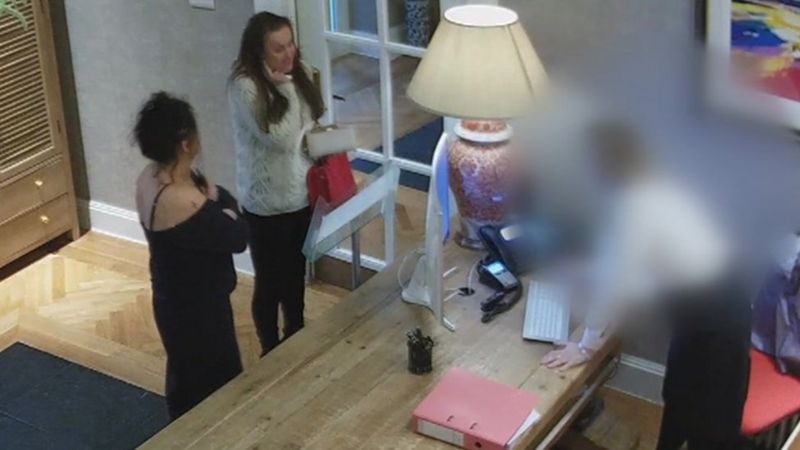
The height and width of the screenshot is (450, 800). Find the location of `cabinet`. cabinet is located at coordinates (29, 100).